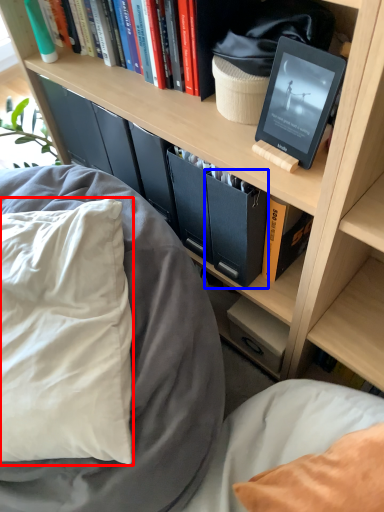
Question: Which object is closer to the camera taking this photo, pillow (highlighted by a red box) or paperback book (highlighted by a blue box)?

Choices:
 (A) pillow
 (B) paperback book

Answer: (A)